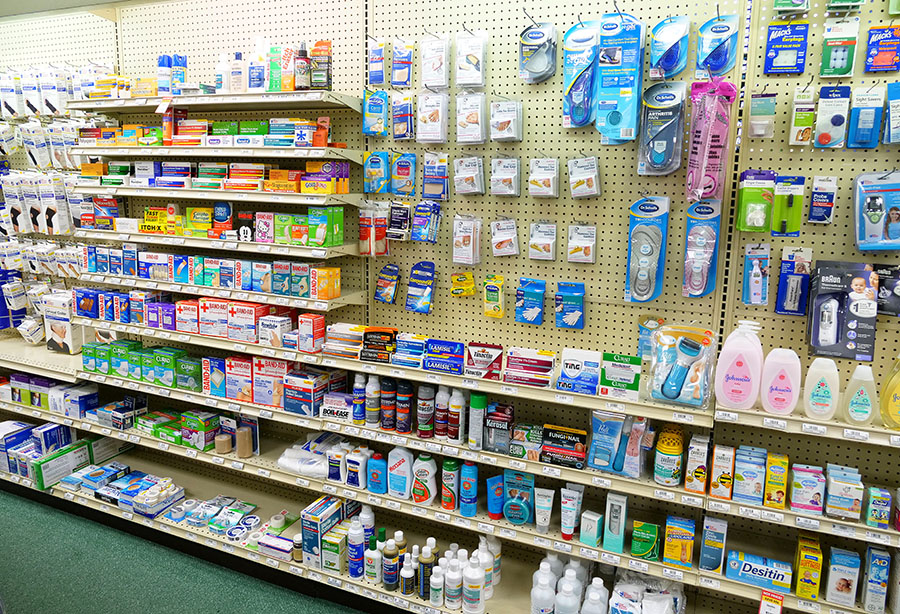
The height and width of the screenshot is (614, 900). I want to click on highest shelf, so click(x=248, y=94).